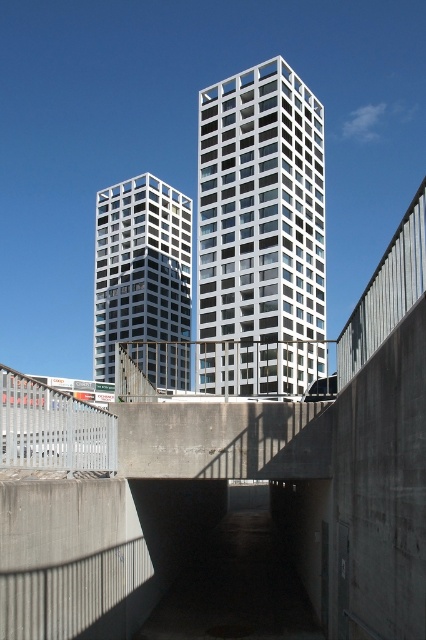
Question: Which point appears farthest from the camera in this image?

Choices:
 (A) (207, 157)
 (B) (120, 320)

Answer: (B)

Question: Is concrete bridge at center smaller than white glass building at center?

Choices:
 (A) no
 (B) yes

Answer: (A)

Question: Which of the following is the farthest from the observer?

Choices:
 (A) (285, 472)
 (B) (186, 241)
 (C) (114, 486)

Answer: (B)

Question: Is white glass building at center thinner than matte glass building at left?

Choices:
 (A) no
 (B) yes

Answer: (B)

Question: Does white glass building at center lie behind concrete at center?

Choices:
 (A) no
 (B) yes

Answer: (B)

Question: Which object appears closest to the camera in this image?

Choices:
 (A) matte glass building at left
 (B) concrete at center
 (C) white glass building at center
 (D) concrete bridge at center

Answer: (D)